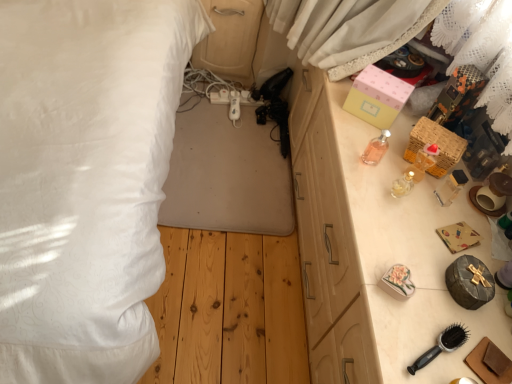
Locate an element on the screen. The width and height of the screenshot is (512, 384). free point behind black plastic hairbrush at lower right is located at coordinates (420, 283).